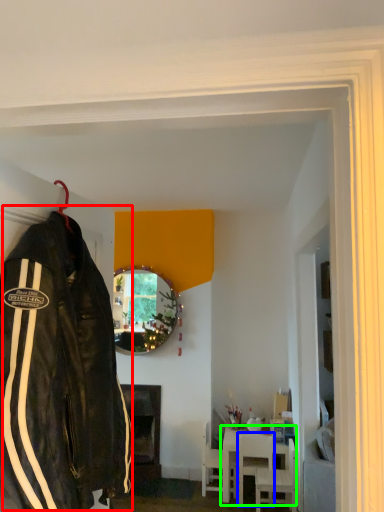
Question: Considering the real-world distances, which object is closest to jacket (highlighted by a red box)? chair (highlighted by a blue box) or table (highlighted by a green box).

Choices:
 (A) chair
 (B) table

Answer: (A)